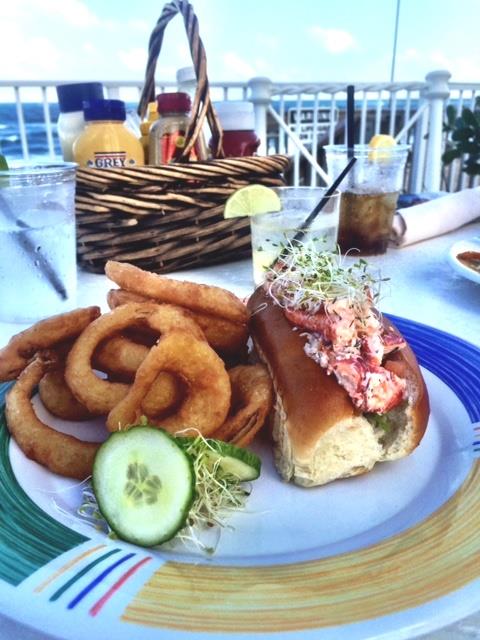
Locate an element on the screen. The width and height of the screenshot is (480, 640). plastic cup is located at coordinates (380, 180), (43, 255).